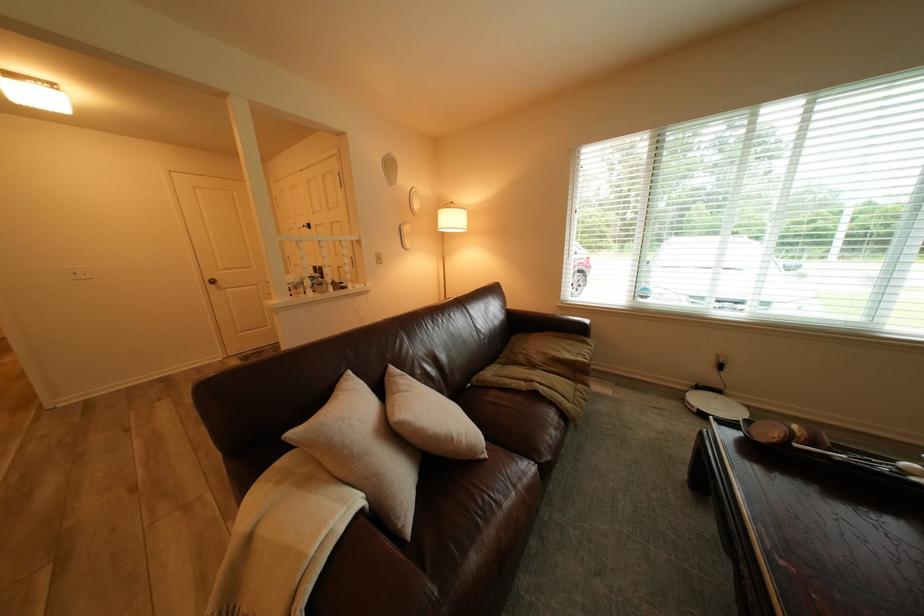
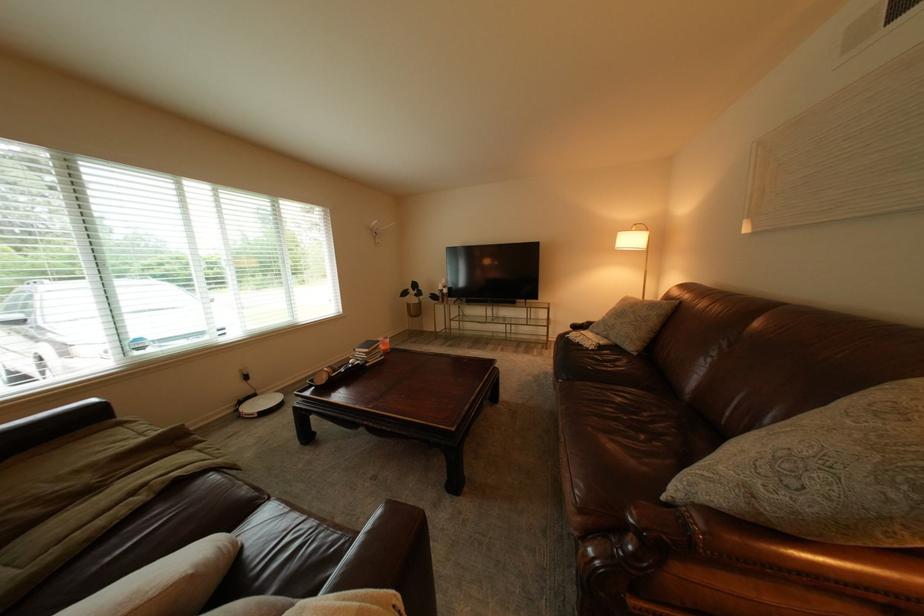
Locate, in the second image, the point that corresponds to point (733, 392) in the first image.

(269, 397)